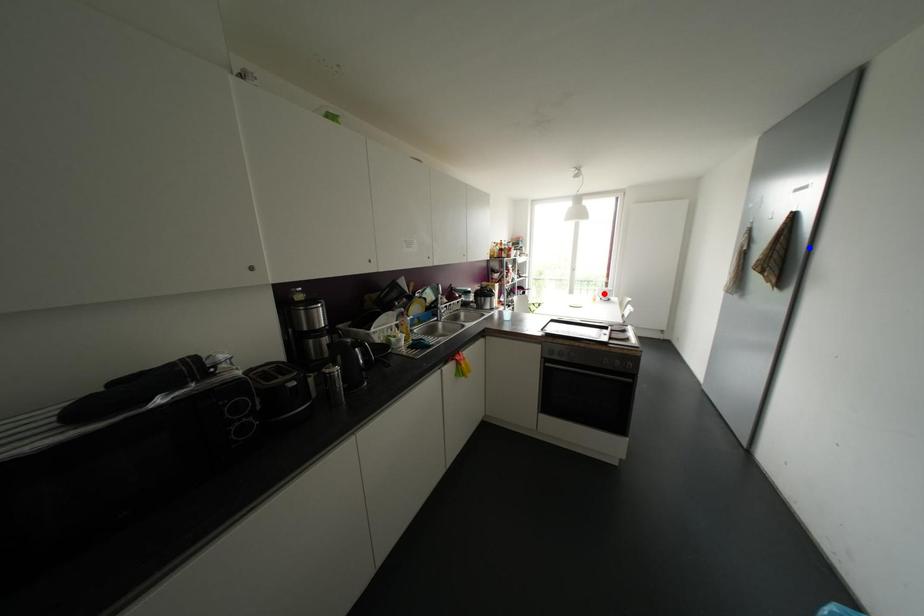
Question: In the image, two points are highlighted. Which point is nearer to the camera? Reply with the corresponding letter.

Choices:
 (A) blue point
 (B) red point

Answer: (A)